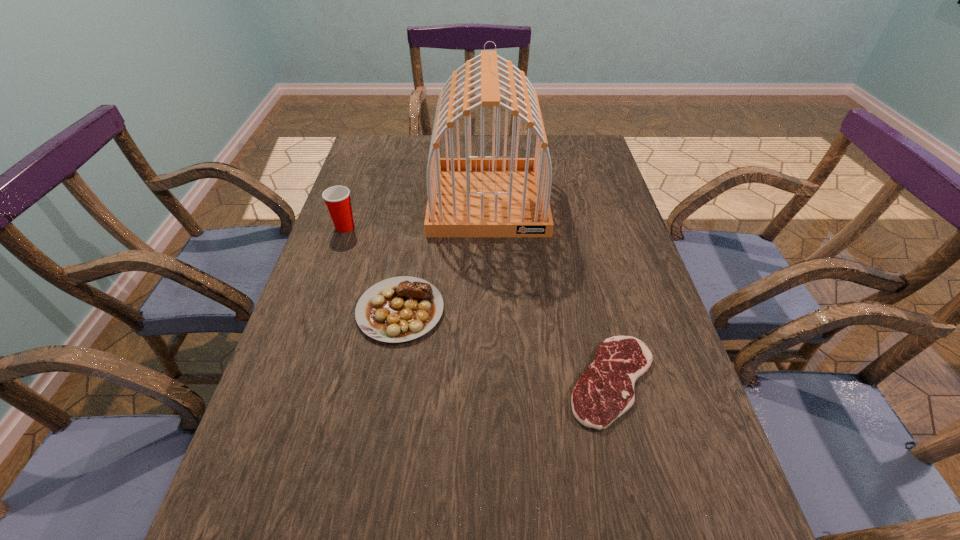
Find the location of a particular element. The image size is (960, 540). the tallest object is located at coordinates (478, 196).

In order to click on Dixie cup in this screenshot , I will do `click(337, 198)`.

Where is `the third shortest object`? This screenshot has width=960, height=540. the third shortest object is located at coordinates (337, 198).

This screenshot has height=540, width=960. In order to click on the left steak in this screenshot , I will do `click(399, 309)`.

The height and width of the screenshot is (540, 960). What are the coordinates of `the second shortest object` in the screenshot? It's located at (399, 309).

Locate an element on the screen. the shortest object is located at coordinates (605, 391).

Image resolution: width=960 pixels, height=540 pixels. In order to click on the shorter steak in this screenshot , I will do `click(605, 391)`.

I want to click on free location located 0.170m with an open door on the birdcage, so click(490, 283).

Identify the location of vacant space positioned 0.060m on the right of the leftmost object. The width and height of the screenshot is (960, 540). (380, 227).

In order to click on free space located 0.100m on the back of the left steak in this screenshot , I will do `click(410, 252)`.